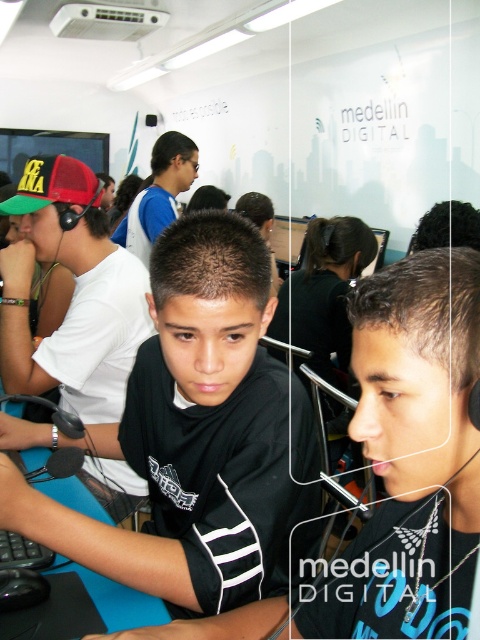
Between black matte shirt at center and black jersey at center, which one has more height?

Standing taller between the two is black matte shirt at center.

Measure the distance from black matte shirt at center to black jersey at center.

black matte shirt at center and black jersey at center are 8.92 inches apart from each other.

The width and height of the screenshot is (480, 640). Describe the element at coordinates (193, 436) in the screenshot. I see `black matte shirt at center` at that location.

The image size is (480, 640). In order to click on black matte shirt at center in this screenshot , I will do `click(193, 436)`.